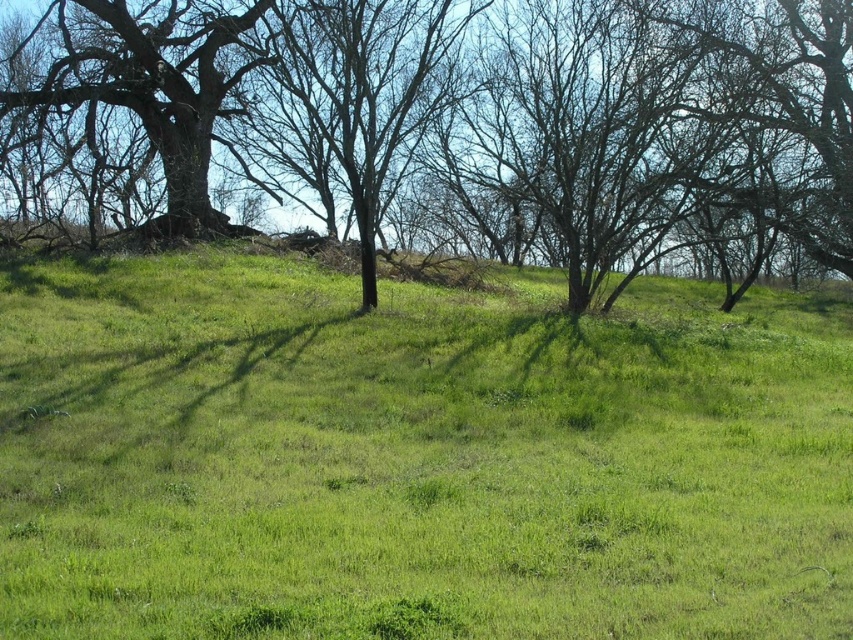
Does brown rough bark tree at upper left appear on the left side of smooth bark tree at left?

In fact, brown rough bark tree at upper left is to the right of smooth bark tree at left.

Does brown rough bark tree at upper left have a greater width compared to smooth bark tree at left?

Yes, brown rough bark tree at upper left is wider than smooth bark tree at left.

At what (x,y) coordinates should I click in order to perform the action: click on brown rough bark tree at upper left. Please return your answer as a coordinate pair (x, y). Image resolution: width=853 pixels, height=640 pixels. Looking at the image, I should click on (764, 88).

Who is more forward, (723, 620) or (730, 16)?

Point (723, 620) is in front.

Identify the location of green grassy hillside at center. This screenshot has width=853, height=640. (413, 458).

Where is `green grassy hillside at center`? green grassy hillside at center is located at coordinates (413, 458).

Is green grassy hillside at center bigger than smooth bark tree at left?

No.

Is green grassy hillside at center wider than smooth bark tree at left?

Yes, green grassy hillside at center is wider than smooth bark tree at left.

Image resolution: width=853 pixels, height=640 pixels. What do you see at coordinates (413, 458) in the screenshot? I see `green grassy hillside at center` at bounding box center [413, 458].

Where is `green grassy hillside at center`? green grassy hillside at center is located at coordinates (413, 458).